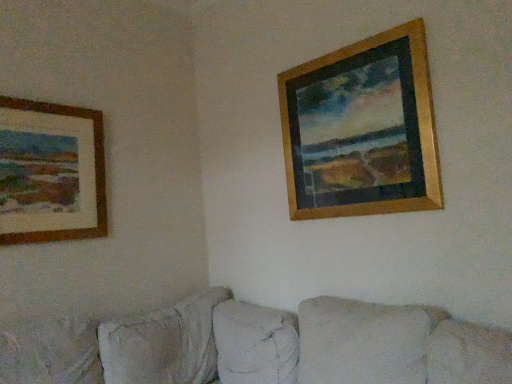
Question: Is wooden frame at left, which ranks as the second picture frame in right-to-left order, next to wooden frame at upper right, which appears as the first picture frame when viewed from the right?

Choices:
 (A) yes
 (B) no

Answer: (B)

Question: Is wooden frame at left, which ranks as the second picture frame in right-to-left order, positioned in front of wooden frame at upper right, the 2th picture frame from the left?

Choices:
 (A) no
 (B) yes

Answer: (A)

Question: From a real-world perspective, does wooden frame at left, positioned as the 1th picture frame in left-to-right order, sit lower than wooden frame at upper right, which appears as the first picture frame when viewed from the right?

Choices:
 (A) yes
 (B) no

Answer: (A)

Question: From the image's perspective, is wooden frame at left, which ranks as the second picture frame in right-to-left order, located above wooden frame at upper right, the 2th picture frame from the left?

Choices:
 (A) yes
 (B) no

Answer: (B)

Question: Can you confirm if wooden frame at left, which ranks as the second picture frame in right-to-left order, is positioned to the left of wooden frame at upper right, the 2th picture frame from the left?

Choices:
 (A) yes
 (B) no

Answer: (A)

Question: Is wooden frame at left, positioned as the 1th picture frame in left-to-right order, thinner than wooden frame at upper right, the 2th picture frame from the left?

Choices:
 (A) yes
 (B) no

Answer: (A)

Question: Is wooden frame at left, positioned as the 1th picture frame in left-to-right order, behind beige fabric couch at lower center?

Choices:
 (A) no
 (B) yes

Answer: (B)

Question: Is wooden frame at left, which ranks as the second picture frame in right-to-left order, next to beige fabric couch at lower center?

Choices:
 (A) no
 (B) yes

Answer: (A)

Question: Is wooden frame at left, positioned as the 1th picture frame in left-to-right order, oriented away from beige fabric couch at lower center?

Choices:
 (A) yes
 (B) no

Answer: (B)

Question: From the image's perspective, is wooden frame at left, positioned as the 1th picture frame in left-to-right order, above beige fabric couch at lower center?

Choices:
 (A) no
 (B) yes

Answer: (B)

Question: Can you confirm if wooden frame at left, which ranks as the second picture frame in right-to-left order, is bigger than beige fabric couch at lower center?

Choices:
 (A) no
 (B) yes

Answer: (A)

Question: Considering the relative sizes of wooden frame at left, which ranks as the second picture frame in right-to-left order, and beige fabric couch at lower center in the image provided, is wooden frame at left, which ranks as the second picture frame in right-to-left order, thinner than beige fabric couch at lower center?

Choices:
 (A) yes
 (B) no

Answer: (A)

Question: Could wooden frame at left, which ranks as the second picture frame in right-to-left order, be considered to be inside beige fabric couch at lower center?

Choices:
 (A) no
 (B) yes

Answer: (A)